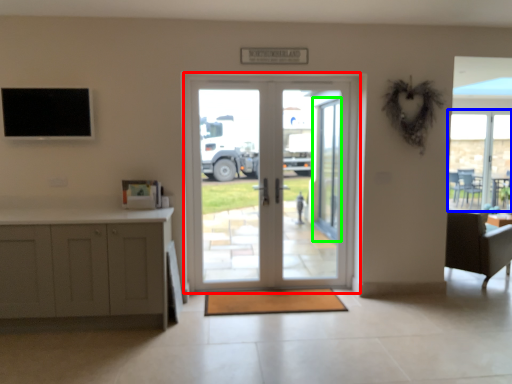
Question: Which object is the closest to the door (highlighted by a red box)? Choose among these: window (highlighted by a blue box) or screen door (highlighted by a green box).

Choices:
 (A) window
 (B) screen door

Answer: (B)